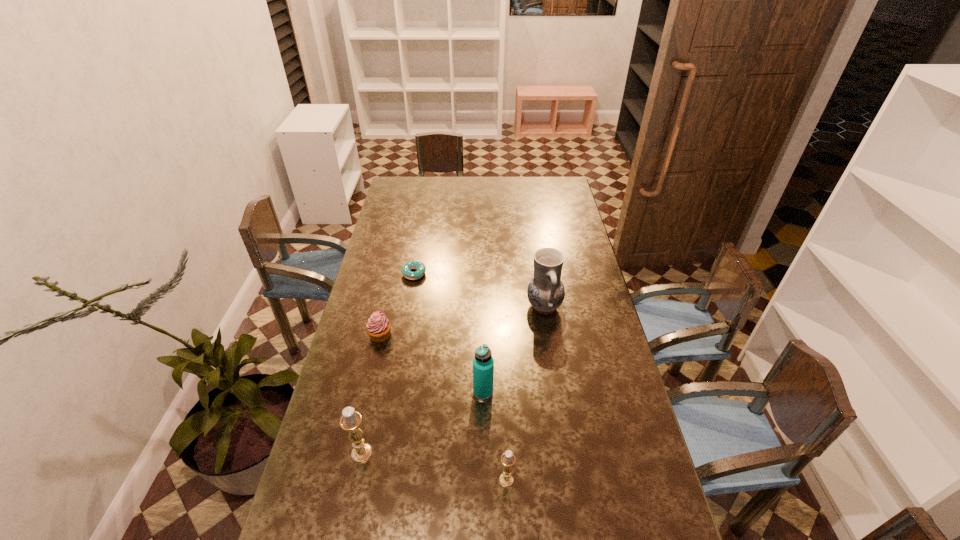
Identify the location of the farther candle holder. This screenshot has width=960, height=540. point(351,420).

Find the location of a particular element. The image size is (960, 540). the left candle holder is located at coordinates (351, 420).

Locate an element on the screen. The image size is (960, 540). the nearest object is located at coordinates (506, 479).

Identify the location of the nearer candle holder. (506, 479).

Locate an element on the screen. This screenshot has width=960, height=540. the second farthest object is located at coordinates (545, 292).

At what (x,y) coordinates should I click in order to perform the action: click on pottery. Please return your answer as a coordinate pair (x, y). The height and width of the screenshot is (540, 960). Looking at the image, I should click on (545, 292).

Identify the location of doughnut. The width and height of the screenshot is (960, 540). point(419,266).

Where is `the shortest object`? This screenshot has height=540, width=960. the shortest object is located at coordinates (419, 266).

Locate an element on the screen. This screenshot has height=540, width=960. the fourth nearest object is located at coordinates (378, 327).

Where is `the second shortest object`? This screenshot has height=540, width=960. the second shortest object is located at coordinates (378, 327).